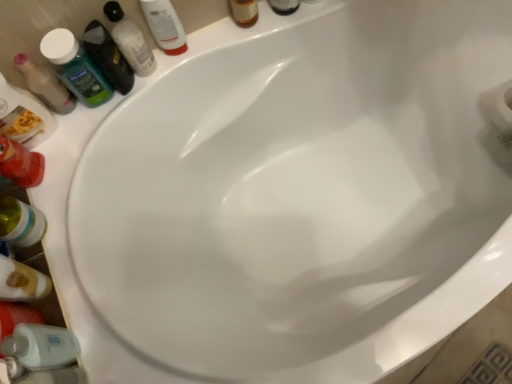
The image size is (512, 384). In order to click on translucent plastic mouthwash at upper left, positioned as the 4th mouthwash in right-to-left order in this screenshot , I will do `click(45, 85)`.

Locate an element on the screen. translucent plastic shampoo bottle at upper left, the first toiletry ordered from the bottom is located at coordinates pyautogui.click(x=108, y=57).

Describe the element at coordinates (165, 26) in the screenshot. This screenshot has height=384, width=512. I see `white glossy mouthwash at upper left, which is counted as the fourth mouthwash, starting from the left` at that location.

Measure the distance between point (7, 286) and camera.

27.52 inches.

Where is `translucent plastic mouthwash at upper left, the 3th mouthwash viewed from the right`? The height and width of the screenshot is (384, 512). translucent plastic mouthwash at upper left, the 3th mouthwash viewed from the right is located at coordinates (75, 67).

Locate an element on the screen. The image size is (512, 384). translucent plastic mouthwash at upper left, which is the 1th mouthwash from left to right is located at coordinates (45, 85).

Considering the positions of objects translucent plastic mouthwash at upper left, which is the 1th mouthwash from left to right, and green matte mouthwash at upper left, placed as the second mouthwash when sorted from right to left, in the image provided, who is more to the right, translucent plastic mouthwash at upper left, which is the 1th mouthwash from left to right, or green matte mouthwash at upper left, placed as the second mouthwash when sorted from right to left,?

Positioned to the right is green matte mouthwash at upper left, placed as the second mouthwash when sorted from right to left.

Is translucent plastic mouthwash at upper left, which is the 1th mouthwash from left to right, smaller than green matte mouthwash at upper left, marked as the 3th mouthwash in a left-to-right arrangement?

Yes, translucent plastic mouthwash at upper left, which is the 1th mouthwash from left to right, is smaller than green matte mouthwash at upper left, marked as the 3th mouthwash in a left-to-right arrangement.

From a real-world perspective, is translucent plastic mouthwash at upper left, positioned as the 4th mouthwash in right-to-left order, on top of green matte mouthwash at upper left, marked as the 3th mouthwash in a left-to-right arrangement?

Actually, translucent plastic mouthwash at upper left, positioned as the 4th mouthwash in right-to-left order, is physically below green matte mouthwash at upper left, marked as the 3th mouthwash in a left-to-right arrangement, in the real world.

How distant is white glossy mouthwash at upper left, which is counted as the fourth mouthwash, starting from the left, from translucent plastic bottle at lower left?

white glossy mouthwash at upper left, which is counted as the fourth mouthwash, starting from the left, is 53.11 centimeters from translucent plastic bottle at lower left.

Considering the relative sizes of white glossy mouthwash at upper left, which is counted as the fourth mouthwash, starting from the left, and translucent plastic bottle at lower left in the image provided, is white glossy mouthwash at upper left, which is counted as the fourth mouthwash, starting from the left, wider than translucent plastic bottle at lower left?

Incorrect, the width of white glossy mouthwash at upper left, which is counted as the fourth mouthwash, starting from the left, does not surpass that of translucent plastic bottle at lower left.

Does point (151, 20) come closer to viewer compared to point (37, 273)?

No, it is not.

Between white glossy mouthwash at upper left, which is counted as the fourth mouthwash, starting from the left, and translucent plastic bottle at lower left, which one has less height?

white glossy mouthwash at upper left, which is counted as the fourth mouthwash, starting from the left.

Can you tell me how much translucent amber bottle at upper center, which ranks as the second toiletry in bottom-to-top order, and translucent plastic bottle at lower left differ in facing direction?

95.4 degrees.

Can translucent plastic bottle at lower left be found inside translucent amber bottle at upper center, which ranks as the second toiletry in bottom-to-top order?

No, translucent plastic bottle at lower left is not a part of translucent amber bottle at upper center, which ranks as the second toiletry in bottom-to-top order.

Considering the sizes of objects translucent amber bottle at upper center, the second toiletry from the left, and translucent plastic bottle at lower left in the image provided, who is taller, translucent amber bottle at upper center, the second toiletry from the left, or translucent plastic bottle at lower left?

With more height is translucent plastic bottle at lower left.

Is translucent amber bottle at upper center, marked as the 1th toiletry in a right-to-left arrangement, to the left or to the right of translucent plastic bottle at lower left in the image?

translucent amber bottle at upper center, marked as the 1th toiletry in a right-to-left arrangement, is positioned on translucent plastic bottle at lower left's right side.

Can you confirm if translucent plastic shampoo bottle at upper left, the first toiletry ordered from the bottom, is bigger than translucent plastic mouthwash at upper left, which ranks as the second mouthwash in left-to-right order?

No.

Would you say translucent plastic shampoo bottle at upper left, the second toiletry viewed from the top, contains translucent plastic mouthwash at upper left, the 3th mouthwash viewed from the right?

No.

Considering the sizes of objects translucent plastic shampoo bottle at upper left, arranged as the second toiletry when viewed from the right, and translucent plastic mouthwash at upper left, the 3th mouthwash viewed from the right, in the image provided, who is shorter, translucent plastic shampoo bottle at upper left, arranged as the second toiletry when viewed from the right, or translucent plastic mouthwash at upper left, the 3th mouthwash viewed from the right,?

translucent plastic shampoo bottle at upper left, arranged as the second toiletry when viewed from the right, is shorter.

Considering the relative sizes of translucent plastic mouthwash at upper left, positioned as the 4th mouthwash in right-to-left order, and translucent plastic bottle at lower left in the image provided, is translucent plastic mouthwash at upper left, positioned as the 4th mouthwash in right-to-left order, shorter than translucent plastic bottle at lower left?

Yes, translucent plastic mouthwash at upper left, positioned as the 4th mouthwash in right-to-left order, is shorter than translucent plastic bottle at lower left.

Does point (61, 82) lie behind point (2, 255)?

That is True.

From a real-world perspective, is translucent plastic mouthwash at upper left, positioned as the 4th mouthwash in right-to-left order, physically located above or below translucent plastic bottle at lower left?

translucent plastic mouthwash at upper left, positioned as the 4th mouthwash in right-to-left order, is below translucent plastic bottle at lower left.

From the image's perspective, is translucent plastic mouthwash at upper left, positioned as the 4th mouthwash in right-to-left order, above or below translucent plastic bottle at lower left?

Based on their image positions, translucent plastic mouthwash at upper left, positioned as the 4th mouthwash in right-to-left order, is located above translucent plastic bottle at lower left.

In terms of height, does translucent plastic bottle at lower left look taller or shorter compared to translucent plastic mouthwash at upper left, which ranks as the second mouthwash in left-to-right order?

Clearly, translucent plastic bottle at lower left is taller compared to translucent plastic mouthwash at upper left, which ranks as the second mouthwash in left-to-right order.

Which point is more forward, (24, 271) or (74, 83)?

Positioned in front is point (24, 271).

Does translucent plastic bottle at lower left lie in front of translucent plastic mouthwash at upper left, which ranks as the second mouthwash in left-to-right order?

Yes.

From a real-world perspective, who is located higher, translucent plastic bottle at lower left or translucent plastic mouthwash at upper left, which ranks as the second mouthwash in left-to-right order?

translucent plastic bottle at lower left, from a real-world perspective.

Does translucent plastic shampoo bottle at upper left, the first toiletry ordered from the bottom, touch white glossy mouthwash at upper left, placed as the 1th mouthwash when sorted from right to left?

There is a gap between translucent plastic shampoo bottle at upper left, the first toiletry ordered from the bottom, and white glossy mouthwash at upper left, placed as the 1th mouthwash when sorted from right to left.

From the image's perspective, which object appears higher, translucent plastic shampoo bottle at upper left, the second toiletry viewed from the top, or white glossy mouthwash at upper left, placed as the 1th mouthwash when sorted from right to left?

white glossy mouthwash at upper left, placed as the 1th mouthwash when sorted from right to left, appears higher in the image.

Between translucent plastic shampoo bottle at upper left, the first toiletry ordered from the bottom, and white glossy mouthwash at upper left, placed as the 1th mouthwash when sorted from right to left, which one is positioned behind?

white glossy mouthwash at upper left, placed as the 1th mouthwash when sorted from right to left, is further from the camera.

From the image's perspective, which mouthwash is the 2nd one above the translucent plastic mouthwash at upper left, which is the 1th mouthwash from left to right? Please provide its 2D coordinates.

[(130, 40)]

Where is `the 4th mouthwash behind the translucent plastic bottle at lower left, starting your count from the anchor`? The height and width of the screenshot is (384, 512). the 4th mouthwash behind the translucent plastic bottle at lower left, starting your count from the anchor is located at coordinates (165, 26).

Considering their positions, is translucent amber bottle at upper center, which ranks as the second toiletry in bottom-to-top order, positioned closer to translucent plastic bottle at lower left than translucent plastic mouthwash at upper left, which ranks as the second mouthwash in left-to-right order?

Based on the image, translucent plastic mouthwash at upper left, which ranks as the second mouthwash in left-to-right order, appears to be nearer to translucent plastic bottle at lower left.

Based on their spatial positions, is translucent plastic shampoo bottle at upper left, the second toiletry viewed from the top, or translucent plastic mouthwash at upper left, positioned as the 4th mouthwash in right-to-left order, closer to translucent plastic mouthwash at upper left, which ranks as the second mouthwash in left-to-right order?

translucent plastic shampoo bottle at upper left, the second toiletry viewed from the top, is closer to translucent plastic mouthwash at upper left, which ranks as the second mouthwash in left-to-right order.

From the image, which object appears to be nearer to translucent plastic bottle at lower left, white glossy mouthwash at upper left, placed as the 1th mouthwash when sorted from right to left, or translucent plastic shampoo bottle at upper left, the first toiletry ordered from the bottom?

Based on the image, translucent plastic shampoo bottle at upper left, the first toiletry ordered from the bottom, appears to be nearer to translucent plastic bottle at lower left.

When comparing their distances from green matte mouthwash at upper left, marked as the 3th mouthwash in a left-to-right arrangement, does translucent plastic shampoo bottle at upper left, the second toiletry viewed from the top, or white glossy mouthwash at upper left, placed as the 1th mouthwash when sorted from right to left, seem closer?

translucent plastic shampoo bottle at upper left, the second toiletry viewed from the top, lies closer to green matte mouthwash at upper left, marked as the 3th mouthwash in a left-to-right arrangement, than the other object.

Based on their spatial positions, is translucent plastic shampoo bottle at upper left, which ranks as the 1th toiletry in left-to-right order, or white glossy mouthwash at upper left, which is counted as the fourth mouthwash, starting from the left, closer to translucent plastic mouthwash at upper left, which ranks as the second mouthwash in left-to-right order?

Based on the image, translucent plastic shampoo bottle at upper left, which ranks as the 1th toiletry in left-to-right order, appears to be nearer to translucent plastic mouthwash at upper left, which ranks as the second mouthwash in left-to-right order.

Looking at the image, which one is located closer to translucent amber bottle at upper center, marked as the 1th toiletry in a right-to-left arrangement, translucent plastic mouthwash at upper left, which is the 1th mouthwash from left to right, or green matte mouthwash at upper left, placed as the second mouthwash when sorted from right to left?

Based on the image, green matte mouthwash at upper left, placed as the second mouthwash when sorted from right to left, appears to be nearer to translucent amber bottle at upper center, marked as the 1th toiletry in a right-to-left arrangement.

Looking at the image, which one is located further to translucent plastic shampoo bottle at upper left, which ranks as the 1th toiletry in left-to-right order, translucent amber bottle at upper center, positioned as the 1th toiletry in top-to-bottom order, or white glossy mouthwash at upper left, placed as the 1th mouthwash when sorted from right to left?

The object further to translucent plastic shampoo bottle at upper left, which ranks as the 1th toiletry in left-to-right order, is translucent amber bottle at upper center, positioned as the 1th toiletry in top-to-bottom order.

Looking at the image, which one is located closer to translucent plastic mouthwash at upper left, positioned as the 4th mouthwash in right-to-left order, translucent amber bottle at upper center, positioned as the 1th toiletry in top-to-bottom order, or translucent plastic shampoo bottle at upper left, the second toiletry viewed from the top?

translucent plastic shampoo bottle at upper left, the second toiletry viewed from the top, is positioned closer to the anchor translucent plastic mouthwash at upper left, positioned as the 4th mouthwash in right-to-left order.

Locate an element on the screen. The image size is (512, 384). mouthwash situated between translucent plastic mouthwash at upper left, positioned as the 4th mouthwash in right-to-left order, and translucent plastic shampoo bottle at upper left, the first toiletry ordered from the bottom, from left to right is located at coordinates (75, 67).

The image size is (512, 384). Find the location of `toiletry between green matte mouthwash at upper left, placed as the second mouthwash when sorted from right to left, and translucent plastic bottle at lower left vertically`. toiletry between green matte mouthwash at upper left, placed as the second mouthwash when sorted from right to left, and translucent plastic bottle at lower left vertically is located at coordinates (108, 57).

At what (x,y) coordinates should I click in order to perform the action: click on mouthwash situated between translucent plastic shampoo bottle at upper left, the first toiletry ordered from the bottom, and white glossy mouthwash at upper left, which is counted as the fourth mouthwash, starting from the left, from left to right. Please return your answer as a coordinate pair (x, y). This screenshot has width=512, height=384. Looking at the image, I should click on (130, 40).

You are a GUI agent. You are given a task and a screenshot of the screen. Output one action in this format:
    pyautogui.click(x=<x>, y=<y>)
    Task: Click on the toiletry between translucent plastic mouthwash at upper left, the 3th mouthwash viewed from the right, and green matte mouthwash at upper left, marked as the 3th mouthwash in a left-to-right arrangement, from left to right
    
    Given the screenshot: What is the action you would take?
    pyautogui.click(x=108, y=57)